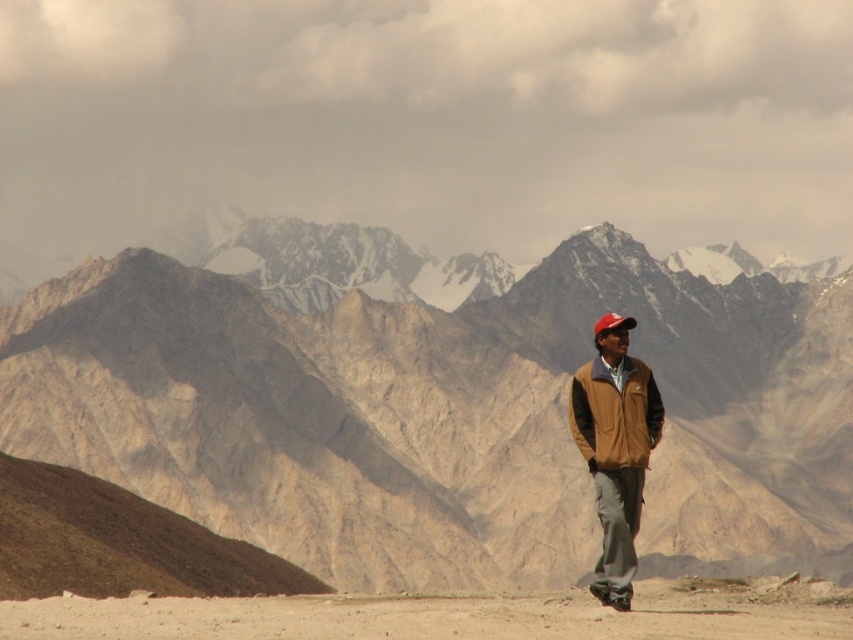
You are planning a hiking route and see the rugged stone mountain range at center and the brown fleece jacket at lower right in the image. Which object takes up more horizontal space in the image?

The rugged stone mountain range at center takes up more horizontal space because its width is larger than that of the brown fleece jacket at lower right.

You are a hiker standing at the starting point of your trail. You see the rugged stone mountain range at center and the brown fleece jacket at lower right. Which object is positioned to the right of the other?

The rugged stone mountain range at center is to the right of brown fleece jacket at lower right.

You are a hiker planning to cross the barren terrain in the image. You see the brown suede jacket at center and the red matte cap at center. Which item is closer to you as you look at the scene?

The brown suede jacket at center is closer to you because it is in front of the red matte cap at center.